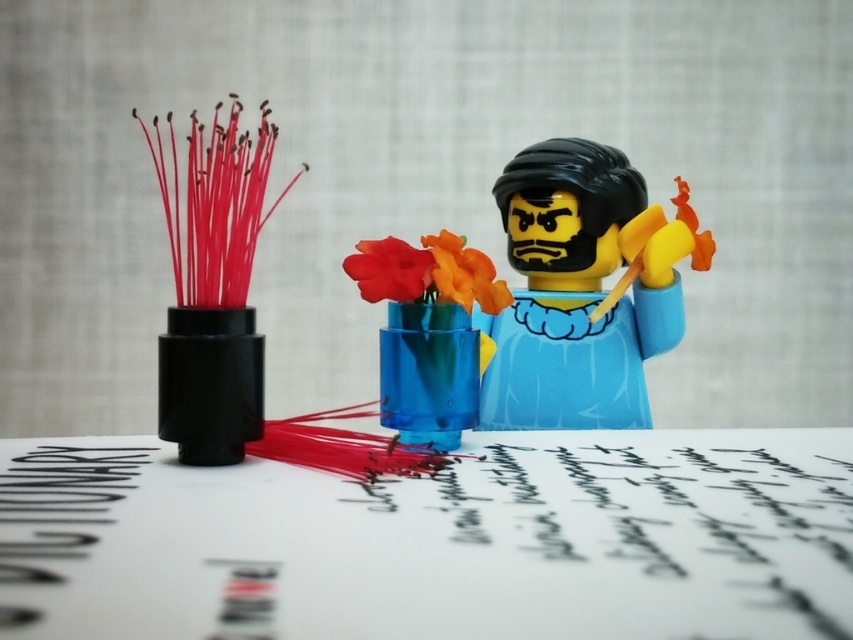
Is black matte hairpin at left taller than glossy plastic flower at center?

Yes.

Can you confirm if black matte hairpin at left is positioned to the left of glossy plastic flower at center?

Correct, you'll find black matte hairpin at left to the left of glossy plastic flower at center.

Locate an element on the screen. The height and width of the screenshot is (640, 853). black matte hairpin at left is located at coordinates (213, 291).

Is translucent blue vase at center closer to camera compared to orange matte flower at center?

Yes, translucent blue vase at center is in front of orange matte flower at center.

Describe the element at coordinates (428, 332) in the screenshot. I see `translucent blue vase at center` at that location.

The width and height of the screenshot is (853, 640). Identify the location of translucent blue vase at center. (428, 332).

Does white paper at center appear on the right side of black matte hairpin at left?

Yes, white paper at center is to the right of black matte hairpin at left.

Based on the photo, which is more to the right, white paper at center or black matte hairpin at left?

From the viewer's perspective, white paper at center appears more on the right side.

Identify the location of white paper at center. Image resolution: width=853 pixels, height=640 pixels. (434, 540).